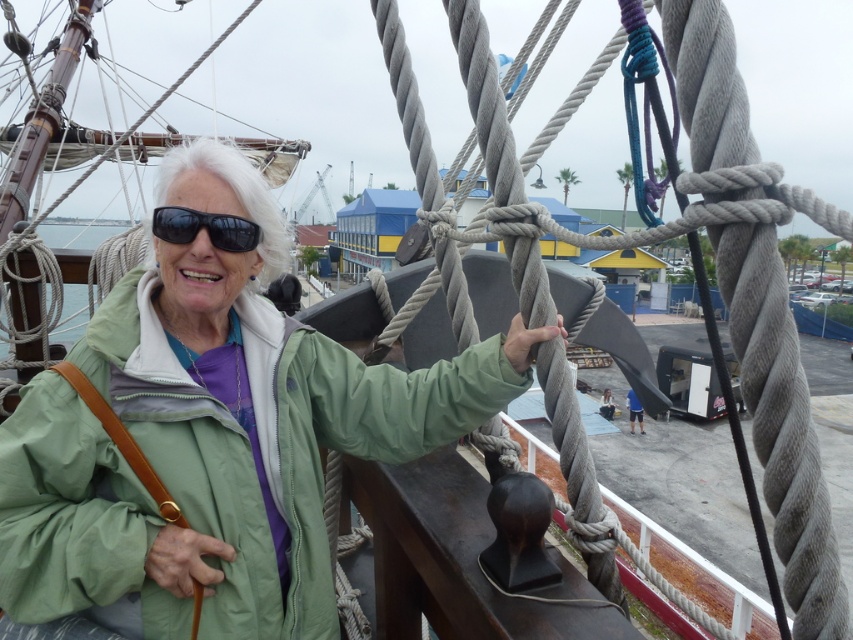
Question: Which of the following is the closest to the observer?

Choices:
 (A) black matte sunglasses at upper left
 (B) green matte jacket at center

Answer: (B)

Question: Is green matte jacket at center wider than black matte sunglasses at upper left?

Choices:
 (A) yes
 (B) no

Answer: (A)

Question: Does green matte jacket at center have a smaller size compared to black matte sunglasses at upper left?

Choices:
 (A) no
 (B) yes

Answer: (A)

Question: Is green matte jacket at center positioned before black matte sunglasses at upper left?

Choices:
 (A) yes
 (B) no

Answer: (A)